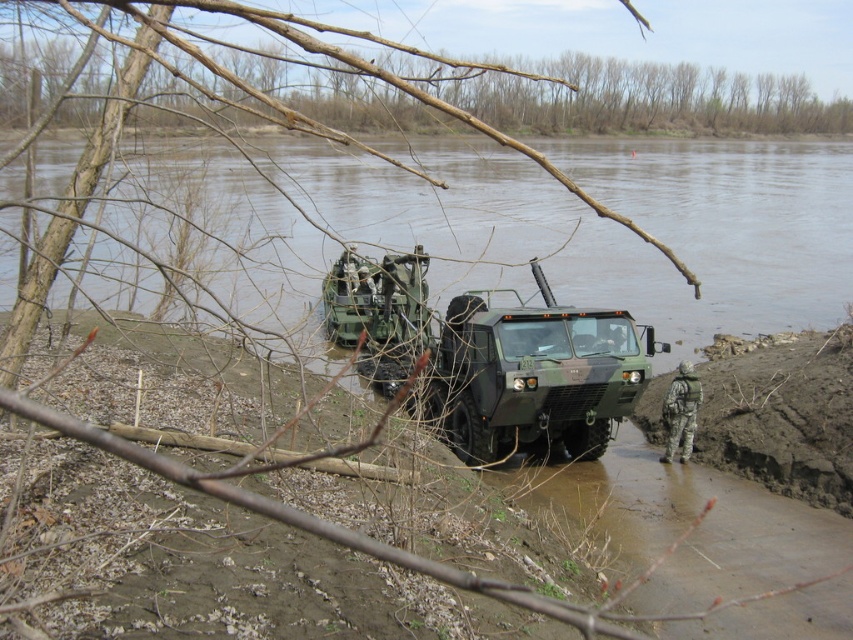
You are a soldier positioned at the point with coordinates point [543,442]. You need to cross the river to reach a safe zone located 15 meters away from your current position. Can you safely cross the river without needing to swim?

The distance between point [543,442] and the viewer is 13.28 meters. Since the safe zone is 15 meters away, you can safely cross the river without needing to swim as the distance is within reach.

You are a soldier needing to cross the shallow river with your equipment. The green matte military truck at center and the brown bark tree at upper center are in your line of sight. Which object is closer to you based on their sizes?

The green matte military truck at center is closer to you because it appears smaller than the brown bark tree at upper center, which is further away.

What are the coordinates of the green matte military truck at center?

The green matte military truck at center is located at coordinates point (532, 376).